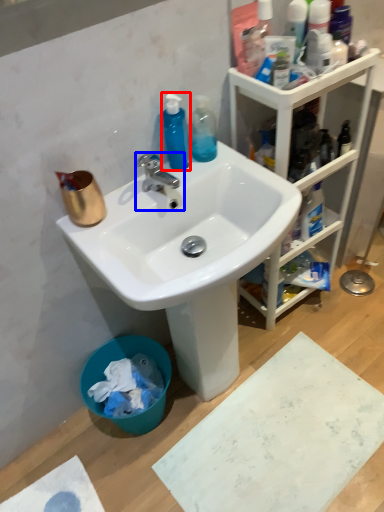
Question: Which object appears farthest to the camera in this image, cleaning product (highlighted by a red box) or tap (highlighted by a blue box)?

Choices:
 (A) cleaning product
 (B) tap

Answer: (A)